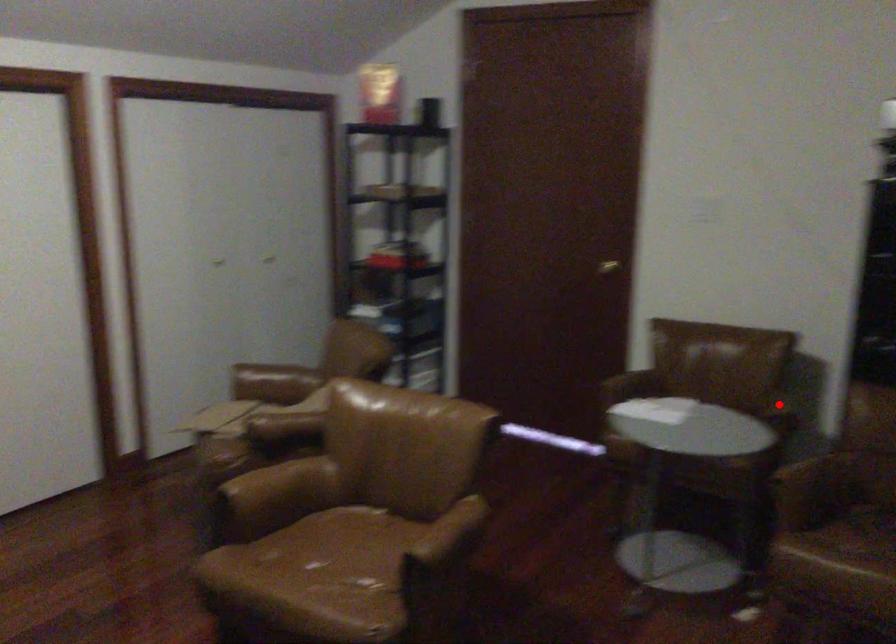
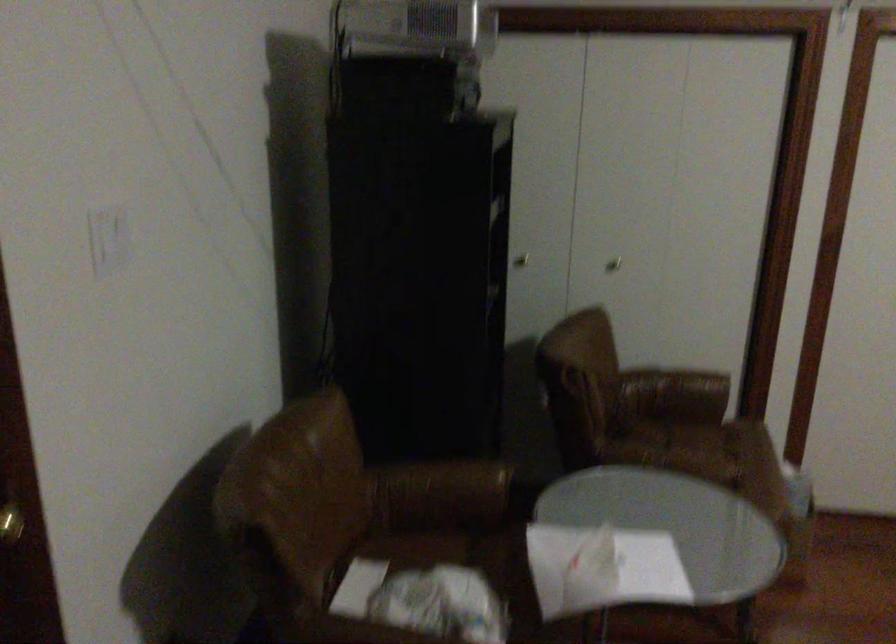
Question: I am providing you with two images of the same scene from different viewpoints. In image1, a red point is highlighted. Considering the same 3D point in image2, which of the following is correct?

Choices:
 (A) It is closer
 (B) It is farther

Answer: (A)